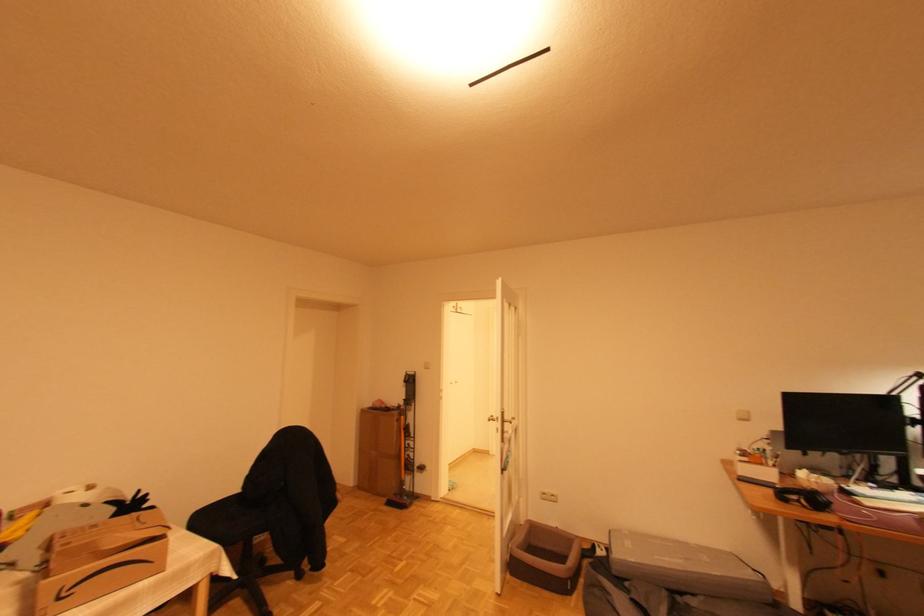
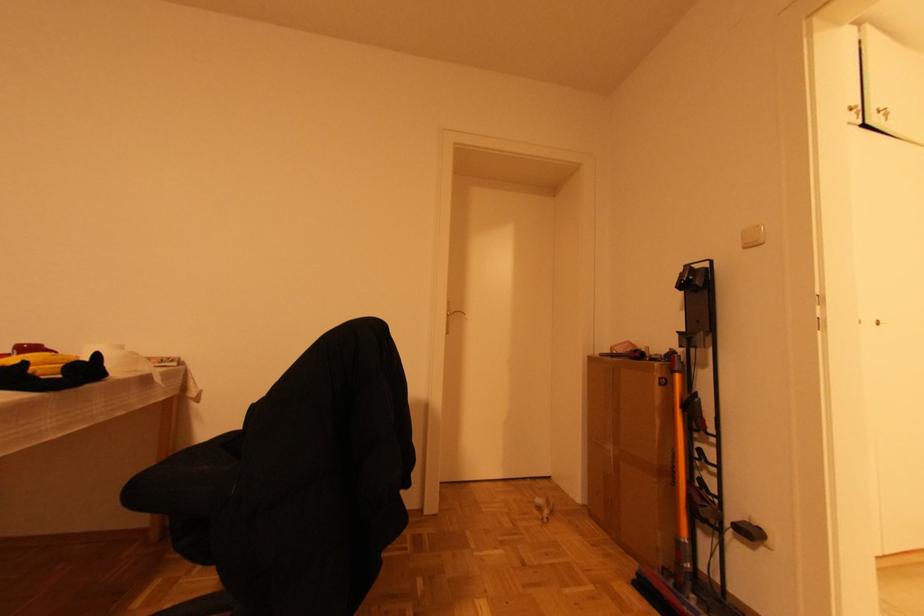
The point at (x=415, y=458) is marked in the first image. Where is the corresponding point in the second image?

(716, 492)